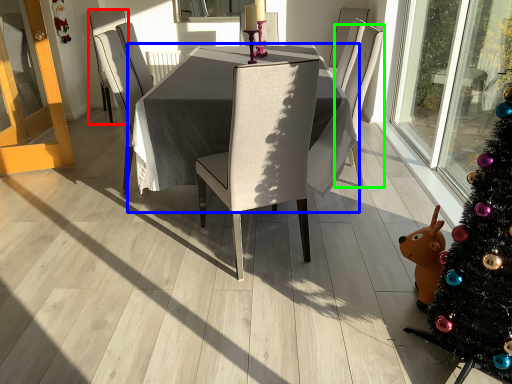
Question: Estimate the real-world distances between objects in this image. Which object is farther from chair (highlighted by a red box), table (highlighted by a blue box) or chair (highlighted by a green box)?

Choices:
 (A) table
 (B) chair

Answer: (B)